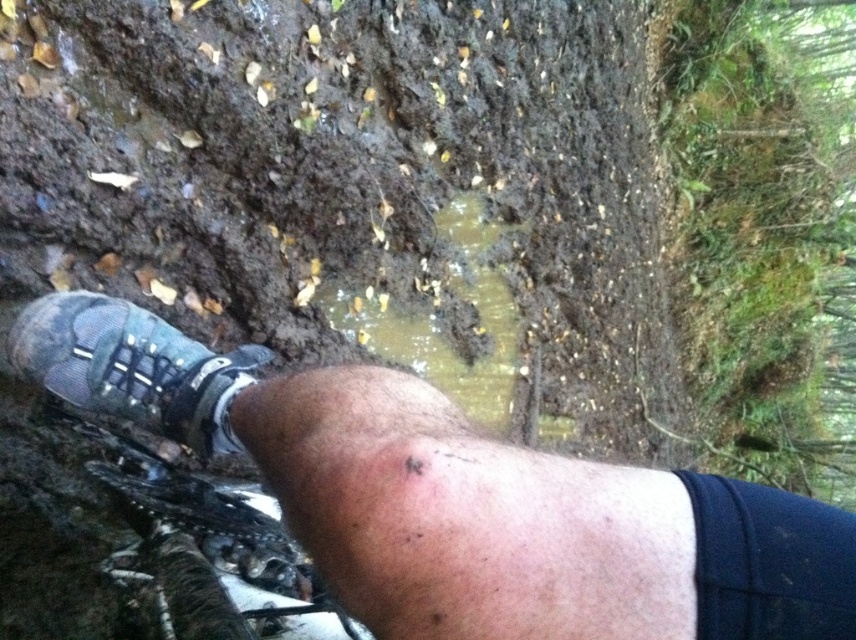
Question: Can you confirm if textured gray shoe at lower left is smaller than matte mesh shoe at lower left?

Choices:
 (A) yes
 (B) no

Answer: (B)

Question: Among these objects, which one is farthest from the camera?

Choices:
 (A) matte mesh shoe at lower left
 (B) textured gray shoe at lower left

Answer: (A)

Question: Which point is farther to the camera?

Choices:
 (A) textured gray shoe at lower left
 (B) matte mesh shoe at lower left

Answer: (B)

Question: Is textured gray shoe at lower left wider than matte mesh shoe at lower left?

Choices:
 (A) no
 (B) yes

Answer: (B)

Question: Can you confirm if textured gray shoe at lower left is positioned above matte mesh shoe at lower left?

Choices:
 (A) yes
 (B) no

Answer: (B)

Question: Which object is farther from the camera taking this photo?

Choices:
 (A) matte mesh shoe at lower left
 (B) textured gray shoe at lower left

Answer: (A)